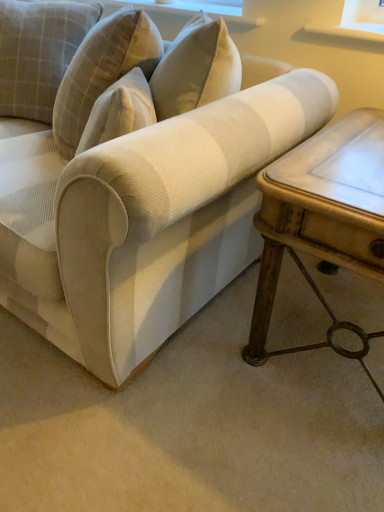
Question: From the image's perspective, does white textured fabric couch at center appear lower than white marble table at right?

Choices:
 (A) no
 (B) yes

Answer: (A)

Question: Considering the relative sizes of white textured fabric couch at center and white marble table at right in the image provided, is white textured fabric couch at center taller than white marble table at right?

Choices:
 (A) no
 (B) yes

Answer: (B)

Question: From the image's perspective, does white textured fabric couch at center appear higher than white marble table at right?

Choices:
 (A) yes
 (B) no

Answer: (A)

Question: Can white marble table at right be found inside white textured fabric couch at center?

Choices:
 (A) no
 (B) yes

Answer: (A)

Question: Would you say white textured fabric couch at center is a long distance from white marble table at right?

Choices:
 (A) no
 (B) yes

Answer: (A)

Question: Is white marble table at right spatially inside white textured fabric couch at center, or outside of it?

Choices:
 (A) outside
 (B) inside

Answer: (A)

Question: Considering the positions of point (336, 165) and point (92, 223), is point (336, 165) closer or farther from the camera than point (92, 223)?

Choices:
 (A) farther
 (B) closer

Answer: (A)

Question: From a real-world perspective, is white marble table at right above or below white textured fabric couch at center?

Choices:
 (A) below
 (B) above

Answer: (A)

Question: Looking at their shapes, would you say white marble table at right is wider or thinner than white textured fabric couch at center?

Choices:
 (A) wide
 (B) thin

Answer: (B)

Question: From the image's perspective, relative to white marble table at right, is white textured fabric couch at center above or below?

Choices:
 (A) above
 (B) below

Answer: (A)

Question: From a real-world perspective, is white textured fabric couch at center physically located above or below white marble table at right?

Choices:
 (A) above
 (B) below

Answer: (A)

Question: In the image, is white textured fabric couch at center on the left side or the right side of white marble table at right?

Choices:
 (A) left
 (B) right

Answer: (A)

Question: Is point (33, 148) positioned closer to the camera than point (266, 194)?

Choices:
 (A) farther
 (B) closer

Answer: (A)

Question: Would you say white textured fabric couch at center is to the left or to the right of plaid fabric pillow at upper left in the picture?

Choices:
 (A) right
 (B) left

Answer: (A)

Question: Choose the correct answer: Is white textured fabric couch at center inside plaid fabric pillow at upper left or outside it?

Choices:
 (A) outside
 (B) inside

Answer: (A)